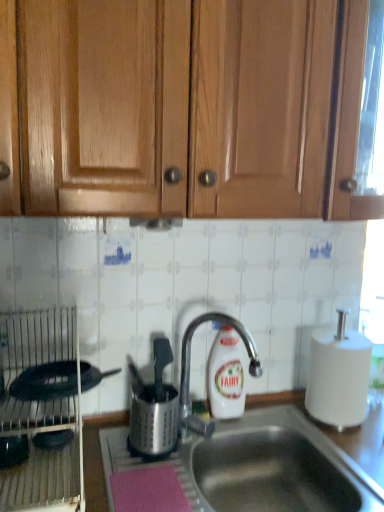
Question: Considering the relative positions of stainless steel sink at center and white matte paper towel at right in the image provided, is stainless steel sink at center in front of white matte paper towel at right?

Choices:
 (A) yes
 (B) no

Answer: (A)

Question: Can you confirm if stainless steel sink at center is positioned to the right of white matte paper towel at right?

Choices:
 (A) no
 (B) yes

Answer: (A)

Question: Considering the relative sizes of stainless steel sink at center and white matte paper towel at right in the image provided, is stainless steel sink at center shorter than white matte paper towel at right?

Choices:
 (A) yes
 (B) no

Answer: (A)

Question: Is stainless steel sink at center outside of white matte paper towel at right?

Choices:
 (A) no
 (B) yes

Answer: (B)

Question: Could white matte paper towel at right be considered to be inside stainless steel sink at center?

Choices:
 (A) yes
 (B) no

Answer: (B)

Question: Is point (233, 365) positioned closer to the camera than point (16, 348)?

Choices:
 (A) closer
 (B) farther

Answer: (B)

Question: From a real-world perspective, is white plastic bottle at center above or below metallic silver dish rack at left, the second appliance viewed from the right?

Choices:
 (A) below
 (B) above

Answer: (A)

Question: Considering their positions, is white plastic bottle at center located in front of or behind metallic silver dish rack at left, which ranks as the first appliance in left-to-right order?

Choices:
 (A) behind
 (B) front

Answer: (A)

Question: From their relative heights in the image, would you say white plastic bottle at center is taller or shorter than metallic silver dish rack at left, which ranks as the first appliance in left-to-right order?

Choices:
 (A) short
 (B) tall

Answer: (A)

Question: Is satin silver utensil holder at center, which is counted as the 2th appliance, starting from the left, taller or shorter than stainless steel sink at center?

Choices:
 (A) short
 (B) tall

Answer: (B)

Question: Is satin silver utensil holder at center, the 1th appliance from the right, inside the boundaries of stainless steel sink at center, or outside?

Choices:
 (A) outside
 (B) inside

Answer: (A)

Question: Considering the positions of satin silver utensil holder at center, which is counted as the 2th appliance, starting from the left, and stainless steel sink at center in the image, is satin silver utensil holder at center, which is counted as the 2th appliance, starting from the left, wider or thinner than stainless steel sink at center?

Choices:
 (A) wide
 (B) thin

Answer: (B)

Question: Does point (157, 377) appear closer or farther from the camera than point (319, 506)?

Choices:
 (A) farther
 (B) closer

Answer: (A)

Question: From their relative heights in the image, would you say white plastic bottle at center is taller or shorter than wooden cabinet doors at upper center?

Choices:
 (A) short
 (B) tall

Answer: (A)

Question: Visually, is white plastic bottle at center positioned to the left or to the right of wooden cabinet doors at upper center?

Choices:
 (A) left
 (B) right

Answer: (A)